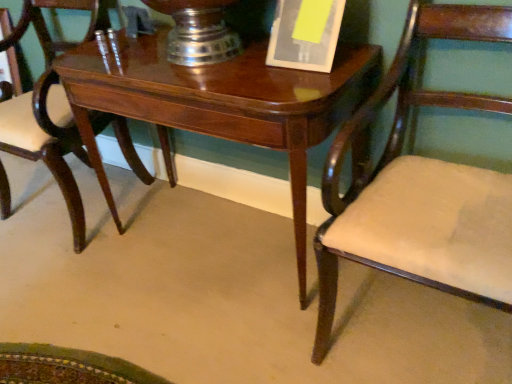
Where is `vacant space underneath mahogany wood chair at center, acting as the second chair starting from the right (from a real-world perspective)`? vacant space underneath mahogany wood chair at center, acting as the second chair starting from the right (from a real-world perspective) is located at coordinates (87, 207).